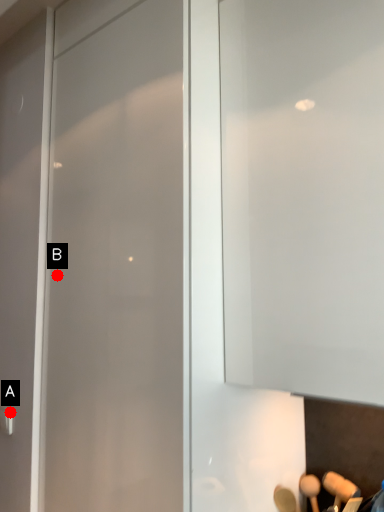
Question: Two points are circled on the image, labeled by A and B beside each circle. Which point is further to the camera?

Choices:
 (A) A is further
 (B) B is further

Answer: (A)